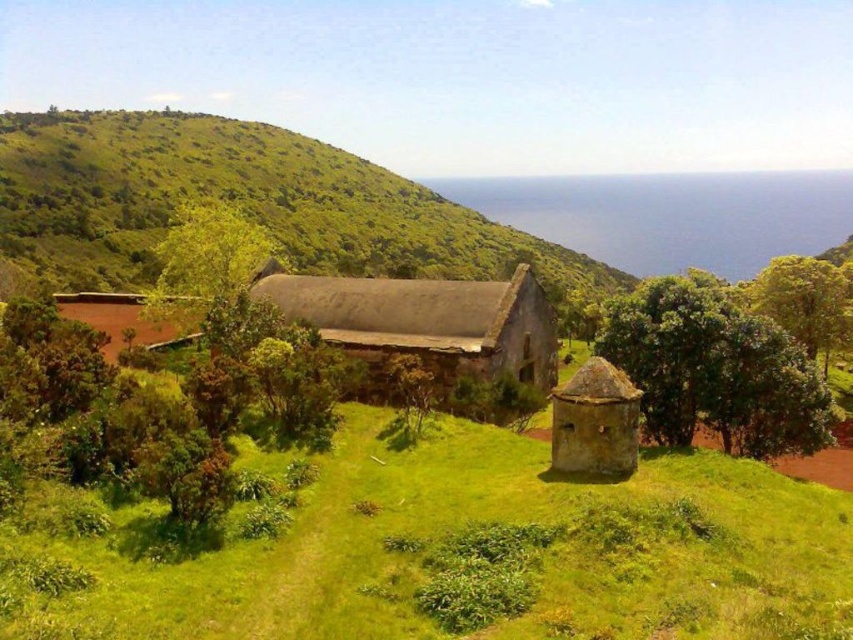
You are a hiker who wants to take shelter from the rain. You see a green leafy tree at center and a brown wooden hut at lower left. Which one would provide better protection from the rain?

The brown wooden hut at lower left would provide better protection from the rain because the green leafy tree at center is positioned over it, meaning the tree might not fully cover the hut and could allow rain to seep through its branches, whereas the hut is a solid structure designed for shelter.

You are standing at the center of the grassy area in the scene. You see two points marked as point 1 and point 2. Point 1 is at coordinates point [277,250] and point 2 is at coordinates point [167,328]. Which point is closer to you?

Point 1 is closer to you because it is further to the camera than point 2, meaning it is nearer in the scene.

You are standing in the middle of the grassy area and want to walk to the dilapidated building with a curved roof. There are two points marked in the image, point 1 at coordinates point [463,301] and point 2 at coordinates point [80,301]. Which point is closer to you as you stand in the grassy area?

Point [463,301] is closer to the viewer than point [80,301]. Therefore, point 1 is closer to you as you stand in the grassy area.